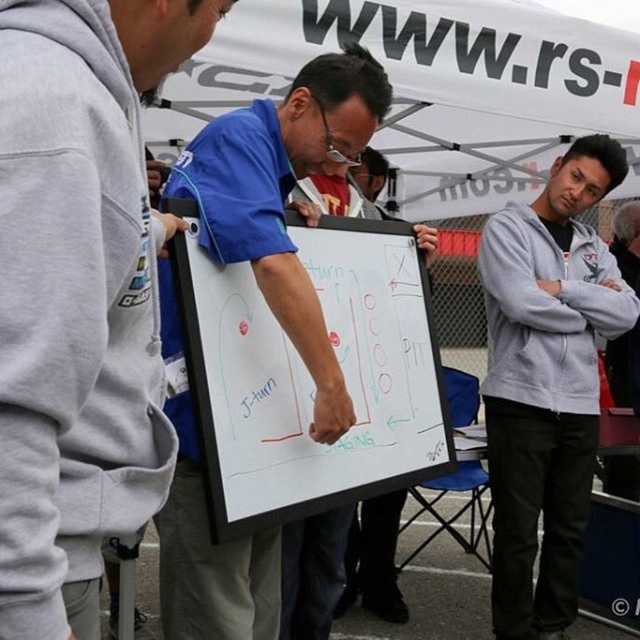
You are holding a 1 meter long stick and want to reach the point marked as point (29, 413) on the whiteboard. Can you reach it with your stick?

The point (29, 413) is 85.42 centimeters away from the camera, so yes, you can reach it with a 1 meter long stick since it is longer than the distance required.

Consider the image. You are a photographer standing at the center of the scene. You want to take a photo that includes both the gray fleece hoodie at left and the gray fleece jacket at right without any part of them being cut off. What is the minimum width of your camera lens field of view required to capture both subjects in full?

The gray fleece hoodie at left is 2.19 meters away from the gray fleece jacket at right. To capture both subjects without any part being cut off, the camera lens field of view must be at least 2.19 meters wide.

You are part of the group at the whiteboard and need to refer to a document on the white matte clipboard at center. Where should you look to find it?

The white matte clipboard at center is located at point (308, 374), so you should look there to find it.